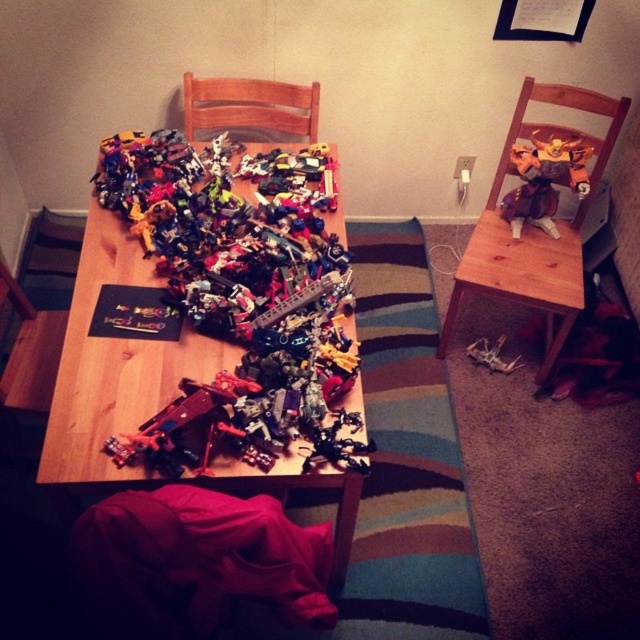
Looking at this image, between wooden chair at upper center and shiny metallic robot at upper right, which one appears on the right side from the viewer's perspective?

shiny metallic robot at upper right

Is wooden chair at upper center behind shiny metallic robot at upper right?

Yes, it is behind shiny metallic robot at upper right.

Image resolution: width=640 pixels, height=640 pixels. Find the location of `wooden chair at upper center`. wooden chair at upper center is located at coordinates (250, 108).

Based on the photo, does wooden table at center have a smaller size compared to shiny metallic robot at upper right?

Incorrect, wooden table at center is not smaller in size than shiny metallic robot at upper right.

Which is in front, point (67, 365) or point (570, 163)?

Point (67, 365) is more forward.

Is point (134, 364) in front of point (586, 157)?

Yes, it is.

You are a GUI agent. You are given a task and a screenshot of the screen. Output one action in this format:
    pyautogui.click(x=<x>, y=<y>)
    Task: Click on the wooden table at center
    The width and height of the screenshot is (640, 640).
    Given the screenshot: What is the action you would take?
    pyautogui.click(x=113, y=364)

Does point (141, 397) come behind point (218, 102)?

No.

Between wooden table at center and wooden chair at upper center, which one appears on the left side from the viewer's perspective?

Positioned to the left is wooden table at center.

Based on the photo, who is more forward, (116, 256) or (186, 136)?

Point (116, 256) is more forward.

Identify the location of wooden table at center. This screenshot has height=640, width=640. (113, 364).